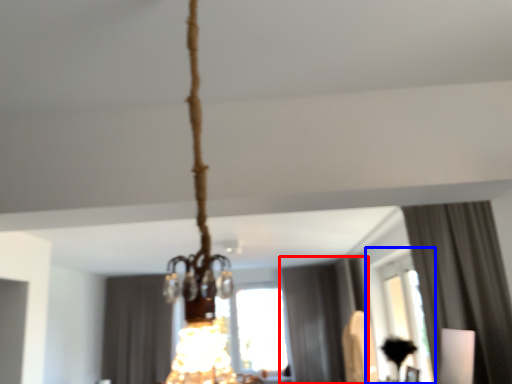
Question: Which point is closer to the camera, curtain (highlighted by a red box) or window (highlighted by a blue box)?

Choices:
 (A) curtain
 (B) window

Answer: (B)